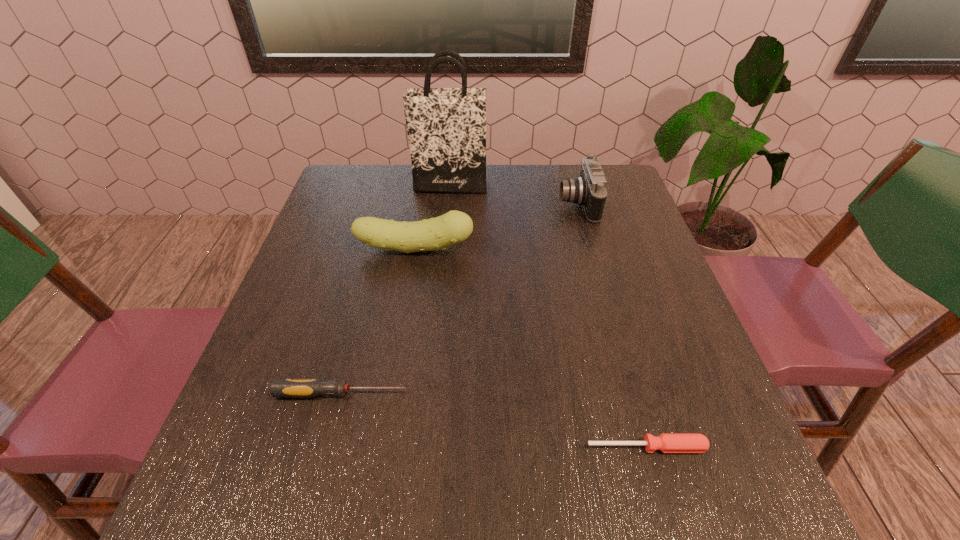
I want to click on vacant space located 0.330m on the front-facing side of the camera, so click(442, 204).

This screenshot has width=960, height=540. Identify the location of free location located on the right of the third farthest object. (538, 249).

At what (x,y) coordinates should I click in order to perform the action: click on free space located 0.350m insert the left screwdriver into a screw head. Please return your answer as a coordinate pair (x, y). Image resolution: width=960 pixels, height=540 pixels. Looking at the image, I should click on (597, 393).

This screenshot has width=960, height=540. In order to click on free region located 0.400m on the back of the nearer screwdriver in this screenshot , I will do `click(599, 276)`.

Where is `shopping bag at the far edge`? The width and height of the screenshot is (960, 540). shopping bag at the far edge is located at coordinates (446, 127).

Where is `camera that is at the far edge`? This screenshot has width=960, height=540. camera that is at the far edge is located at coordinates (589, 190).

Find the location of a particular element. This screenshot has height=540, width=960. cucumber located at the left edge is located at coordinates (453, 227).

This screenshot has width=960, height=540. I want to click on screwdriver that is positioned at the left edge, so click(280, 388).

Where is `camera that is positioned at the right edge`? The width and height of the screenshot is (960, 540). camera that is positioned at the right edge is located at coordinates (589, 190).

In order to click on screwdriver that is positioned at the right edge in this screenshot , I will do `click(666, 442)`.